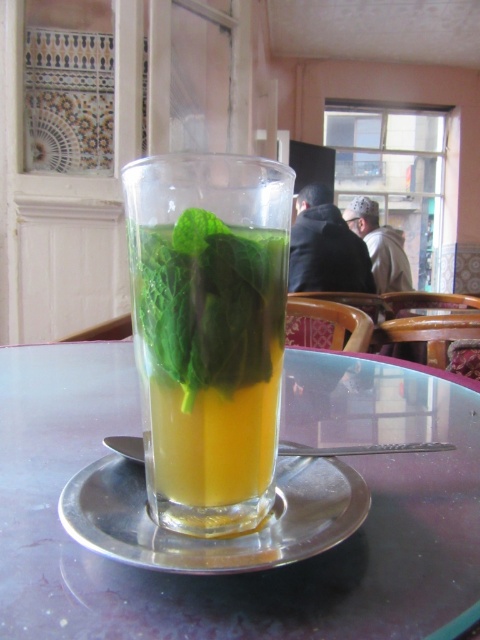
Which is in front, point (227, 308) or point (152, 552)?

Point (152, 552)

What do you see at coordinates (210, 301) in the screenshot? Image resolution: width=480 pixels, height=640 pixels. I see `green leafy mint at center` at bounding box center [210, 301].

Does point (252, 257) lie in front of point (326, 513)?

Yes, it is.

I want to click on green leafy mint at center, so click(x=210, y=301).

I want to click on transparent glass table at center, so click(x=257, y=572).

Is point (410, 486) positioned in front of point (128, 170)?

That is False.

Between point (385, 486) and point (238, 173), which one is positioned in front?

Point (238, 173) is more forward.

This screenshot has height=640, width=480. I want to click on transparent glass table at center, so (257, 572).

Is the position of transparent glass table at center less distant than that of green leafy mint at center?

That is True.

Is point (387, 484) farther from viewer compared to point (180, 333)?

Yes, point (387, 484) is behind point (180, 333).

Does point (450, 516) lie in front of point (168, 269)?

No, it is not.

Where is `transparent glass table at center`? Image resolution: width=480 pixels, height=640 pixels. transparent glass table at center is located at coordinates (257, 572).